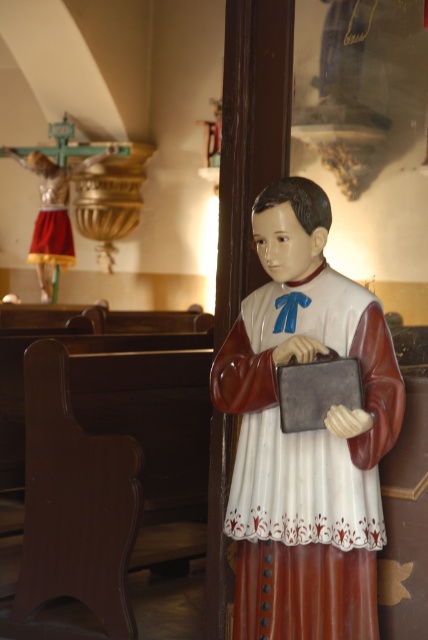
Question: Which object appears farthest from the camera in this image?

Choices:
 (A) matte plastic statue at center
 (B) matte gold statue at upper left

Answer: (B)

Question: Where is matte plastic statue at center located in relation to matte gold statue at upper left in the image?

Choices:
 (A) above
 (B) below

Answer: (B)

Question: Which of the following is the farthest from the observer?

Choices:
 (A) matte plastic statue at center
 (B) matte gold statue at upper left

Answer: (B)

Question: Where is matte plastic statue at center located in relation to matte gold statue at upper left in the image?

Choices:
 (A) above
 (B) below

Answer: (B)

Question: Is matte plastic statue at center above matte gold statue at upper left?

Choices:
 (A) yes
 (B) no

Answer: (B)

Question: Among these objects, which one is farthest from the camera?

Choices:
 (A) matte plastic statue at center
 (B) matte gold statue at upper left

Answer: (B)